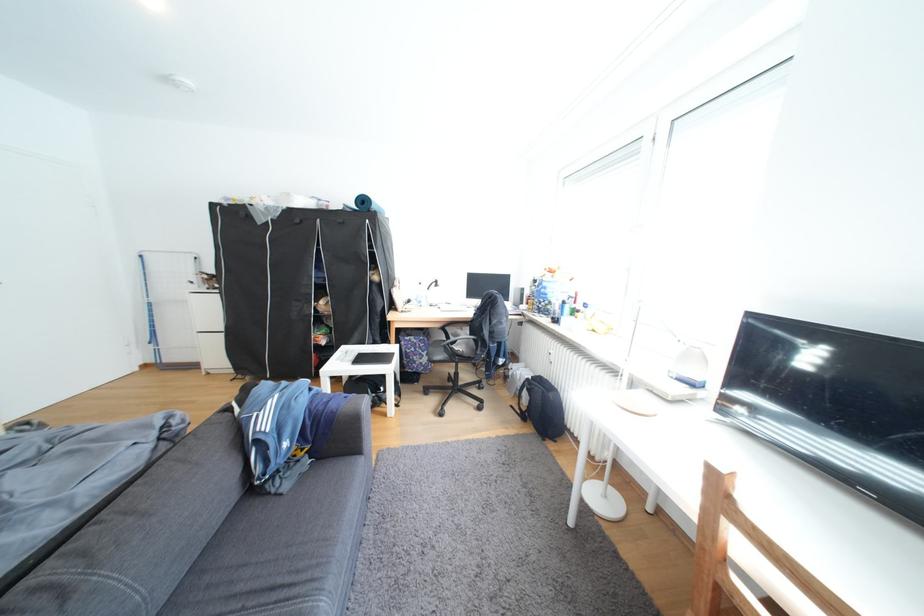
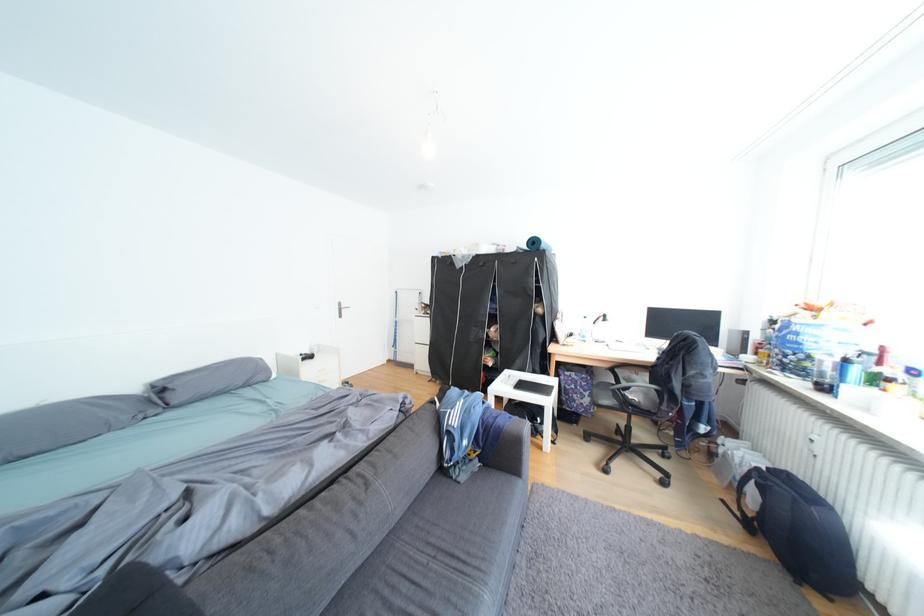
Locate, in the second image, the point that corresponds to pixel 524 407 in the first image.

(736, 501)